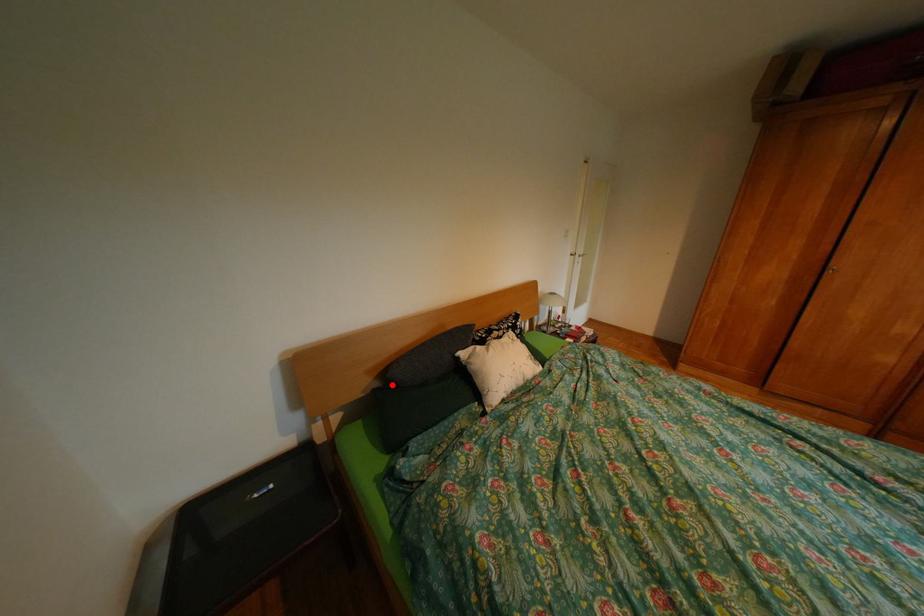
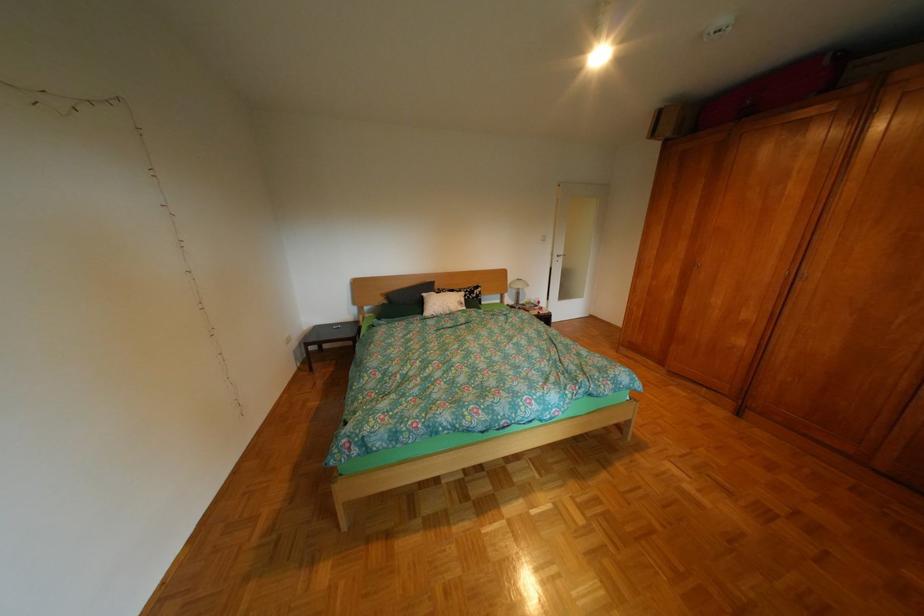
Find the pixel in the second image that matches the highlighted location in the first image.

(400, 302)